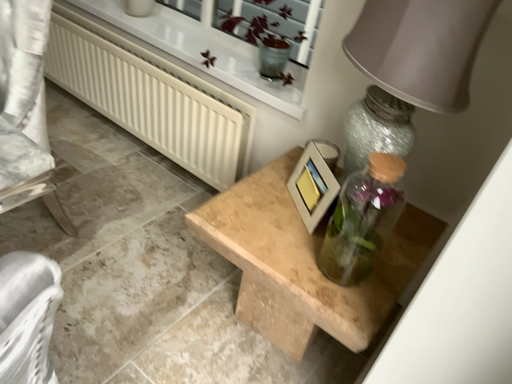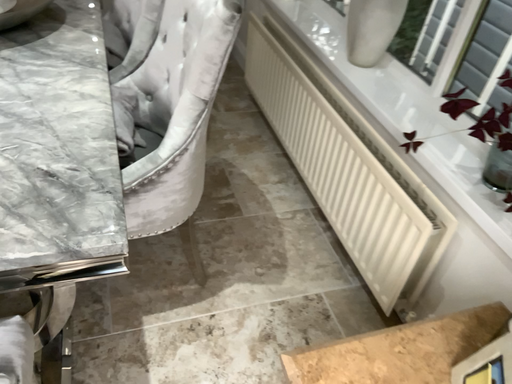
Question: How did the camera likely rotate when shooting the video?

Choices:
 (A) rotated right
 (B) rotated left

Answer: (B)